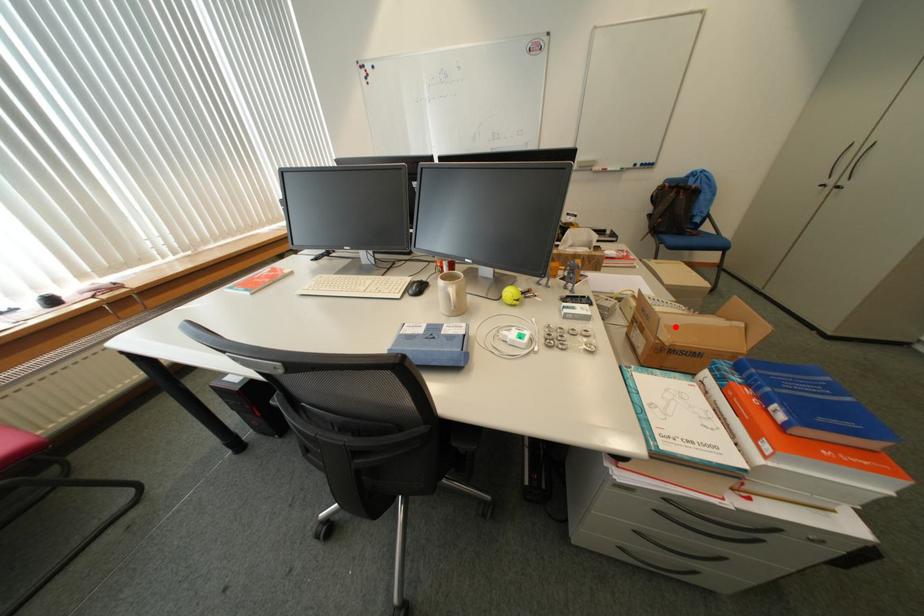
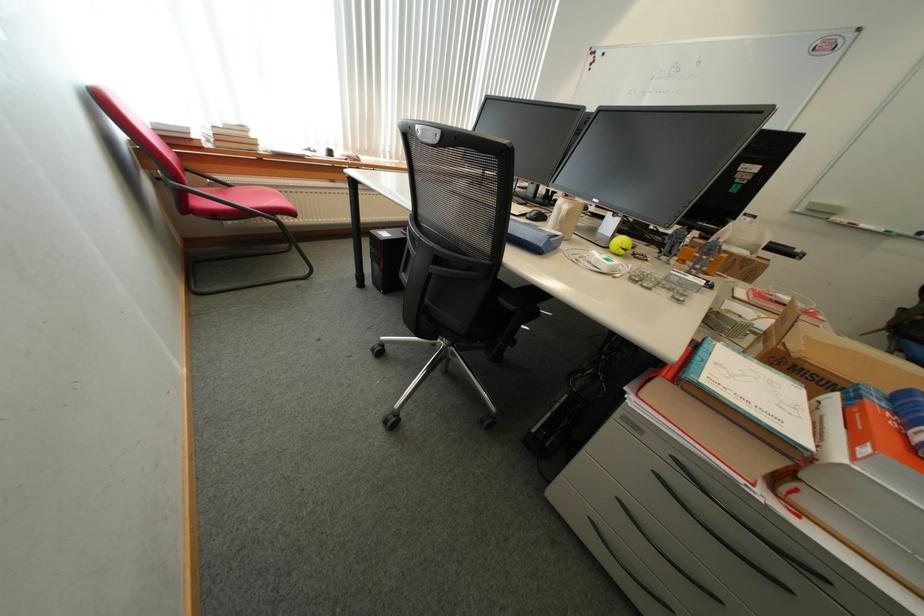
Question: I am providing you with two images of the same scene from different viewpoints. A red point is marked on the first image. At the location where the point appears in image 1, is it still visible in image 2?

Choices:
 (A) Yes
 (B) No

Answer: (A)